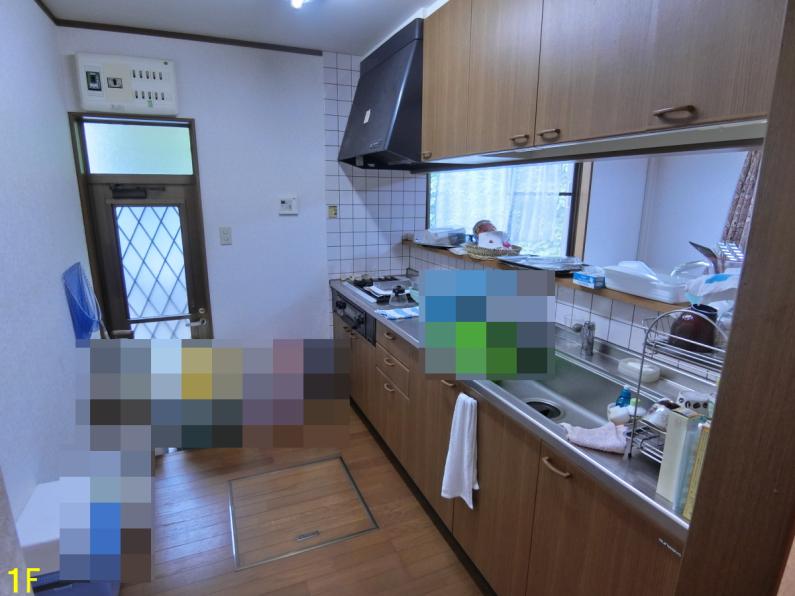
You are a GUI agent. You are given a task and a screenshot of the screen. Output one action in this format:
    pyautogui.click(x=<x>, y=<y>)
    Task: Click on the drawer pulls
    
    Given the screenshot: What is the action you would take?
    pyautogui.click(x=552, y=468), pyautogui.click(x=671, y=544), pyautogui.click(x=386, y=387), pyautogui.click(x=390, y=364), pyautogui.click(x=390, y=336), pyautogui.click(x=514, y=141), pyautogui.click(x=553, y=139), pyautogui.click(x=681, y=121)